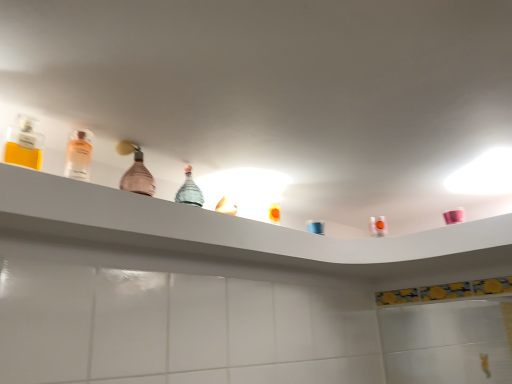
This screenshot has height=384, width=512. In order to click on translucent plastic mouthwash at upper right in this screenshot , I will do `click(378, 226)`.

How much space does pink glass bottle at center, which appears as the 3th bottle when viewed from the left, occupy horizontally?

pink glass bottle at center, which appears as the 3th bottle when viewed from the left, is 4.56 centimeters in width.

The height and width of the screenshot is (384, 512). I want to click on blue plastic container at center, so pos(315,227).

Describe the element at coordinates (24, 143) in the screenshot. I see `clear glass perfume at upper left, the 3th bottle in the right-to-left sequence` at that location.

Measure the distance between clear glass perfume at upper left, which appears as the 1th bottle when viewed from the front, and camera.

The distance of clear glass perfume at upper left, which appears as the 1th bottle when viewed from the front, from camera is 84.35 centimeters.

In order to click on translucent plastic mouthwash at upper right in this screenshot , I will do pos(378,226).

Looking at this image, could you tell me if translucent plastic mouthwash at upper right is facing blue plastic container at center?

Yes.

Does point (379, 227) appear closer or farther from the camera than point (310, 230)?

Point (379, 227) is positioned closer to the camera compared to point (310, 230).

Considering the positions of objects translucent plastic mouthwash at upper right and blue plastic container at center in the image provided, who is more to the left, translucent plastic mouthwash at upper right or blue plastic container at center?

blue plastic container at center is more to the left.

Looking at this image, from the image's perspective, which is above, blue plastic container at center or matte glass bottles at upper center?

blue plastic container at center is shown above in the image.

Does blue plastic container at center appear on the left side of matte glass bottles at upper center?

No, blue plastic container at center is not to the left of matte glass bottles at upper center.

Is blue plastic container at center looking in the opposite direction of matte glass bottles at upper center?

No, blue plastic container at center's orientation is not away from matte glass bottles at upper center.

From a real-world perspective, between blue plastic container at center and matte glass bottles at upper center, who is vertically lower?

In real-world perspective, matte glass bottles at upper center is lower.

Looking at this image, from a real-world perspective, does translucent plastic mouthwash at upper right stand above clear glass perfume at upper left, positioned as the 1th bottle in left-to-right order?

Incorrect, from a real-world perspective, translucent plastic mouthwash at upper right is lower than clear glass perfume at upper left, positioned as the 1th bottle in left-to-right order.

Does translucent plastic mouthwash at upper right lie in front of clear glass perfume at upper left, the 3th bottle in the right-to-left sequence?

That is False.

How distant is translucent plastic mouthwash at upper right from clear glass perfume at upper left, the 3th bottle in the right-to-left sequence?

1.18 meters.

Is blue plastic container at center at the back of clear glass bottle at left, the 2th bottle when ordered from front to back?

clear glass bottle at left, the 2th bottle when ordered from front to back, is not turned away from blue plastic container at center.

Which object is further away from the camera, clear glass bottle at left, the second bottle from the back, or blue plastic container at center?

blue plastic container at center is more distant.

Is clear glass bottle at left, acting as the second bottle starting from the right, situated inside blue plastic container at center or outside?

clear glass bottle at left, acting as the second bottle starting from the right, lies outside blue plastic container at center.

Does clear glass bottle at left, the 2th bottle when ordered from front to back, appear on the left side of matte glass bottles at upper center?

Yes.

This screenshot has width=512, height=384. I want to click on shelf below the clear glass bottle at left, the second bottle from the back (from the image's perspective), so click(x=225, y=224).

Is point (81, 157) closer or farther from the camera than point (41, 216)?

Clearly, point (81, 157) is more distant from the camera than point (41, 216).

Is point (135, 145) more distant than point (89, 137)?

Yes, point (135, 145) is farther from viewer.

Could clear glass bottle at left, the second bottle from the back, be considered to be inside pink glass bottle at center, the 1th bottle from the right?

No, clear glass bottle at left, the second bottle from the back, is located outside of pink glass bottle at center, the 1th bottle from the right.

Would you say pink glass bottle at center, which appears as the 3th bottle when viewed from the left, is to the left or to the right of clear glass bottle at left, the second bottle from the back, in the picture?

From the image, it's evident that pink glass bottle at center, which appears as the 3th bottle when viewed from the left, is to the right of clear glass bottle at left, the second bottle from the back.

Where is `bottle behind the clear glass bottle at left, the 2th bottle when ordered from front to back`? bottle behind the clear glass bottle at left, the 2th bottle when ordered from front to back is located at coordinates (135, 171).

From a real-world perspective, is blue plastic container at center above or below clear glass bottle at left, acting as the second bottle starting from the right?

blue plastic container at center is situated lower than clear glass bottle at left, acting as the second bottle starting from the right, in the real world.

From the image's perspective, who appears lower, blue plastic container at center or clear glass bottle at left, placed as the second bottle when sorted from left to right?

From the image's view, blue plastic container at center is below.

In the scene shown: Is blue plastic container at center placed right next to clear glass bottle at left, the second bottle from the back?

No, blue plastic container at center is not next to clear glass bottle at left, the second bottle from the back.

Would you say blue plastic container at center is inside or outside clear glass bottle at left, the 2th bottle when ordered from front to back?

The correct answer is: outside.

The image size is (512, 384). What are the coordinates of `toiletry that appears in front of the translucent plastic mouthwash at upper right` in the screenshot? It's located at (315, 227).

You are a GUI agent. You are given a task and a screenshot of the screen. Output one action in this format:
    pyautogui.click(x=<x>, y=<y>)
    Task: Click on the toiletry behind the matte glass bottles at upper center
    The image size is (512, 384).
    Given the screenshot: What is the action you would take?
    pyautogui.click(x=315, y=227)

From the image, which object appears to be nearer to blue plastic container at center, clear glass perfume at upper left, positioned as the 1th bottle in left-to-right order, or matte glass bottles at upper center?

matte glass bottles at upper center lies closer to blue plastic container at center than the other object.

When comparing their distances from clear glass perfume at upper left, the 3th bottle positioned from the back, does matte glass bottles at upper center or blue plastic container at center seem further?

Among the two, blue plastic container at center is located further to clear glass perfume at upper left, the 3th bottle positioned from the back.

Based on their spatial positions, is pink glass bottle at center, the 1th bottle from the right, or clear glass bottle at left, the 2th bottle when ordered from front to back, closer to clear glass perfume at upper left, positioned as the 1th bottle in left-to-right order?

clear glass bottle at left, the 2th bottle when ordered from front to back, is closer to clear glass perfume at upper left, positioned as the 1th bottle in left-to-right order.

Considering their positions, is blue plastic container at center positioned further to matte glass bottles at upper center than clear glass bottle at left, acting as the second bottle starting from the right?

blue plastic container at center is further to matte glass bottles at upper center.

From the image, which object appears to be nearer to blue plastic container at center, matte glass bottles at upper center or clear glass bottle at left, the 2th bottle when ordered from front to back?

matte glass bottles at upper center is closer to blue plastic container at center.

Based on the photo, estimate the real-world distances between objects in this image. Which object is closer to blue plastic container at center, clear glass perfume at upper left, positioned as the 1th bottle in left-to-right order, or clear glass bottle at left, acting as the second bottle starting from the right?

clear glass bottle at left, acting as the second bottle starting from the right, is closer to blue plastic container at center.

Estimate the real-world distances between objects in this image. Which object is closer to blue plastic container at center, pink glass bottle at center, which appears as the 3th bottle when viewed from the left, or clear glass perfume at upper left, the 3th bottle positioned from the back?

pink glass bottle at center, which appears as the 3th bottle when viewed from the left, is closer to blue plastic container at center.

Estimate the real-world distances between objects in this image. Which object is closer to clear glass perfume at upper left, which appears as the 1th bottle when viewed from the front, blue plastic container at center or matte glass bottles at upper center?

matte glass bottles at upper center is positioned closer to the anchor clear glass perfume at upper left, which appears as the 1th bottle when viewed from the front.

Locate an element on the screen. The image size is (512, 384). toiletry located between clear glass perfume at upper left, which appears as the 1th bottle when viewed from the front, and translucent plastic mouthwash at upper right in the left-right direction is located at coordinates (315, 227).

Where is `toiletry between clear glass bottle at left, the second bottle from the back, and translucent plastic mouthwash at upper right`? The image size is (512, 384). toiletry between clear glass bottle at left, the second bottle from the back, and translucent plastic mouthwash at upper right is located at coordinates (315, 227).

The height and width of the screenshot is (384, 512). I want to click on toiletry between matte glass bottles at upper center and translucent plastic mouthwash at upper right along the z-axis, so click(x=315, y=227).

Where is `bottle between clear glass bottle at left, acting as the second bottle starting from the right, and blue plastic container at center`? bottle between clear glass bottle at left, acting as the second bottle starting from the right, and blue plastic container at center is located at coordinates (135, 171).